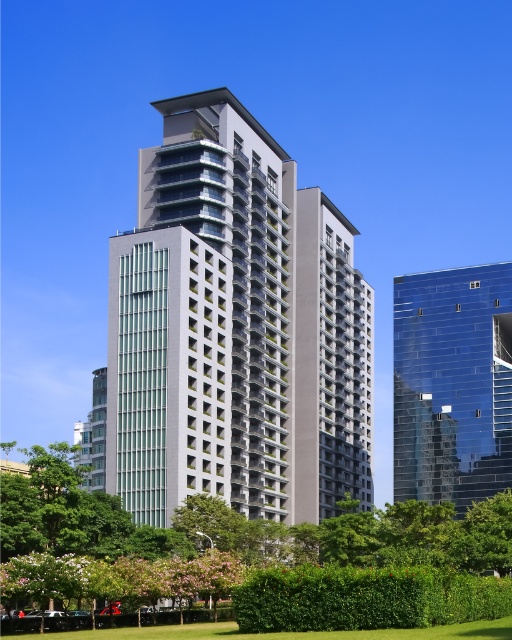
You are a city planner evaluating the urban layout. Based on the image, which area occupies more horizontal space between the green leafy park at center and the transparent glass building at right?

The green leafy park at center might be wider than transparent glass building at right.

You are an architect reviewing a cityscape design. You observe the white glass building at center and the transparent glass building at right. Which building is located to the left of the other?

The white glass building at center is positioned on the left side of the transparent glass building at right.

You are standing at the base of the white glass building at center. You want to take a photo of the building from a distance where it appears smaller but still recognizable. Based on the information provided, what is the minimum distance you should move away from the building to achieve this effect?

The white glass building at center is 99.61 meters away from camera. To make the building appear smaller while still recognizable, you should move to at least 99.61 meters away from the building.